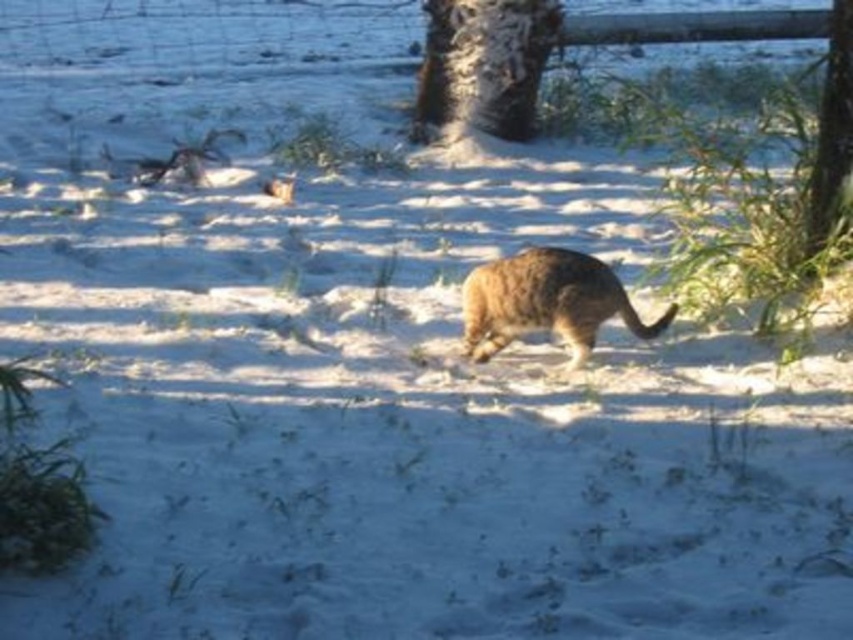
What do you see at coordinates (544, 301) in the screenshot? I see `fuzzy brown cat at center` at bounding box center [544, 301].

Find the location of a particular element. fuzzy brown cat at center is located at coordinates (544, 301).

Does bark textured tree at upper center have a larger size compared to fuzzy brown cat at center?

Yes, bark textured tree at upper center is bigger than fuzzy brown cat at center.

Does bark textured tree at upper center come in front of fuzzy brown cat at center?

No, bark textured tree at upper center is further to the viewer.

Who is more distant from viewer, (521, 0) or (548, 298)?

Point (521, 0)

I want to click on bark textured tree at upper center, so click(x=485, y=61).

Who is higher up, bark textured tree at upper center or brown textured tree trunk at right?

Positioned higher is bark textured tree at upper center.

You are a GUI agent. You are given a task and a screenshot of the screen. Output one action in this format:
    pyautogui.click(x=<x>, y=<y>)
    Task: Click on the bark textured tree at upper center
    
    Given the screenshot: What is the action you would take?
    pyautogui.click(x=485, y=61)

The height and width of the screenshot is (640, 853). Identify the location of bark textured tree at upper center. (485, 61).